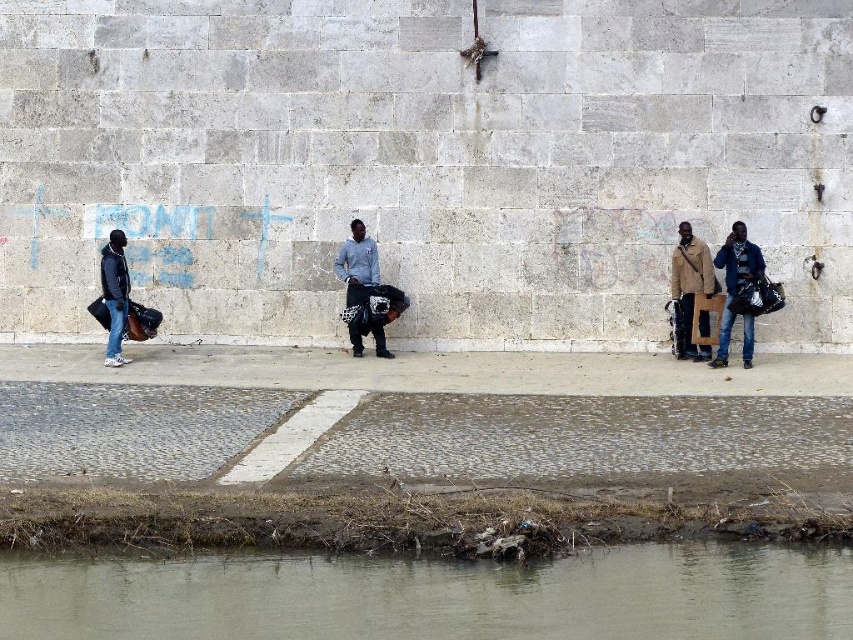
Consider the image. Is brown textured coat at right thinner than jeans at right?

Yes.

Who is positioned more to the right, brown textured coat at right or jeans at right?

Positioned to the right is jeans at right.

Who is more forward, (x=688, y=300) or (x=757, y=280)?

Point (x=757, y=280) is in front.

This screenshot has width=853, height=640. I want to click on brown textured coat at right, so click(x=689, y=289).

Between murky water at lower center and dark gray fabric bag at center, which one is positioned higher?

dark gray fabric bag at center is above.

Does murky water at lower center lie in front of dark gray fabric bag at center?

That is True.

Between point (360, 576) and point (384, 342), which one is positioned behind?

Point (384, 342)

Where is `murky water at lower center`? Image resolution: width=853 pixels, height=640 pixels. murky water at lower center is located at coordinates (433, 595).

Image resolution: width=853 pixels, height=640 pixels. Describe the element at coordinates (433, 595) in the screenshot. I see `murky water at lower center` at that location.

Does murky water at lower center appear on the right side of jeans at right?

No, murky water at lower center is not to the right of jeans at right.

Where is `murky water at lower center`? murky water at lower center is located at coordinates (433, 595).